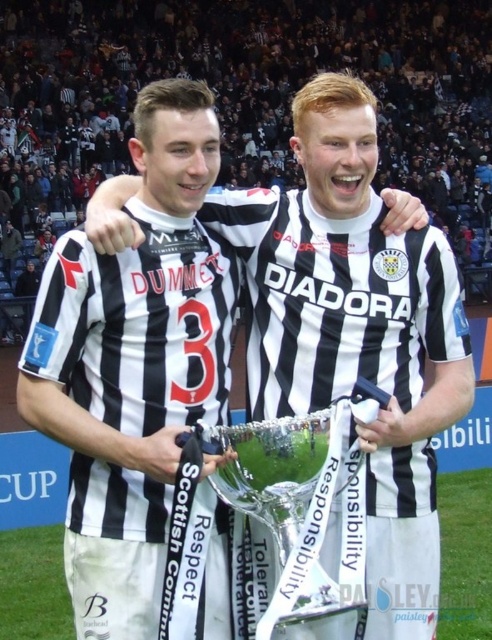
Question: Among these points, which one is nearest to the camera?

Choices:
 (A) (305, 568)
 (B) (8, 548)
 (C) (125, 403)

Answer: (A)

Question: Can you confirm if black and white jersey at center is thinner than silver metallic trophy at center?

Choices:
 (A) no
 (B) yes

Answer: (B)

Question: Which of the following is the closest to the observer?

Choices:
 (A) green grass at center
 (B) black and white jersey at center

Answer: (B)

Question: Does black and white jersey at center appear on the left side of silver metallic trophy at center?

Choices:
 (A) no
 (B) yes

Answer: (B)

Question: Does silver metallic trophy at center come in front of green grass at center?

Choices:
 (A) no
 (B) yes

Answer: (B)

Question: Among these objects, which one is nearest to the camera?

Choices:
 (A) black and white jersey at center
 (B) green grass at center
 (C) silver metallic trophy at center

Answer: (C)